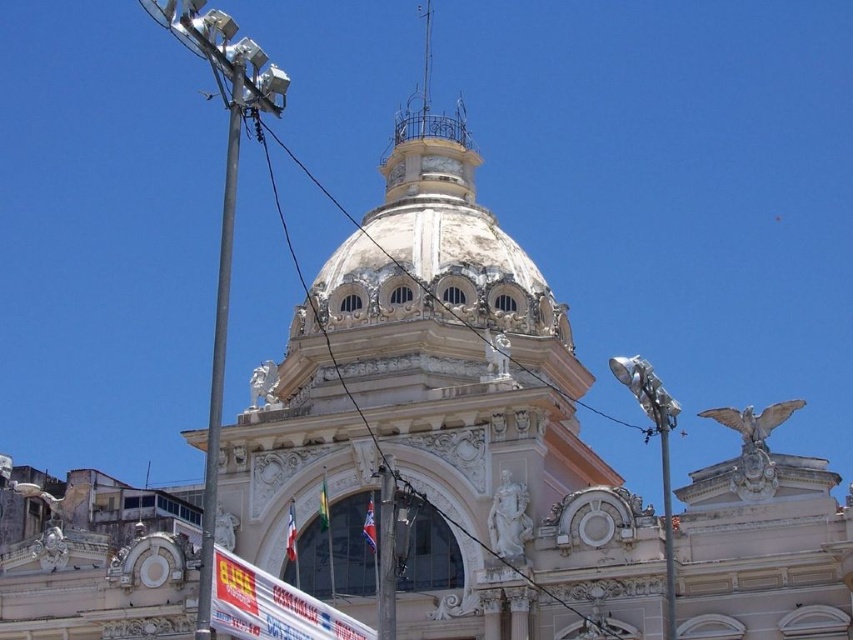
You are standing in front of the grand neoclassical building and notice two points marked on its facade. The first point is at coordinate point (300, 625) and the second is at coordinate point (218, 349). Which of these two points is closer to your line of sight?

Point (300, 625) is closer to the viewer than point (218, 349).

You are a visitor standing in front of the building. You see a white glossy banner at lower center and a metallic pole at center. Which object is closer to the ground?

The white glossy banner at lower center is closer to the ground because it is positioned below the metallic pole at center.

You are a maintenance worker needing to replace a part. You have a 2.5m ladder. The metallic pole at left is 2 meters tall. Can you reach the top of the white wire at center with your ladder?

The metallic pole at left is shorter than white wire at center. Since the metallic pole at left is 2 meters tall, the white wire at center is taller than 2 meters. Your ladder is 2.5 meters, so you can reach the top of the white wire at center.